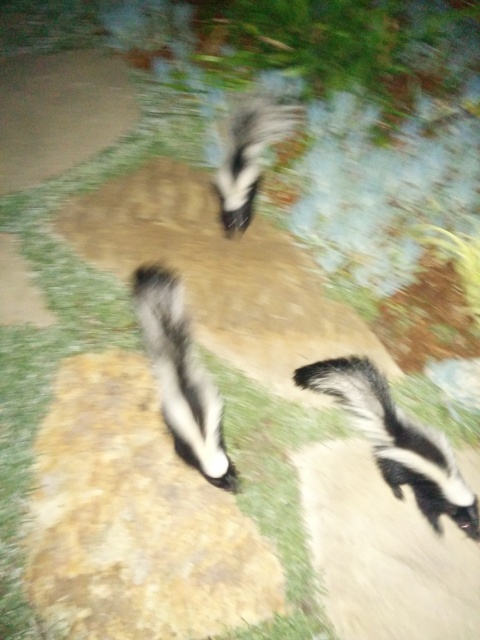
Does black and white fur skunk at center have a larger size compared to black and white fur skunk at upper center?

Actually, black and white fur skunk at center might be smaller than black and white fur skunk at upper center.

Is black and white fur skunk at center shorter than black and white fur skunk at upper center?

Yes.

This screenshot has height=640, width=480. Identify the location of black and white fur skunk at center. (180, 376).

Is black and white fur skunk at lower right wider than black and white fur skunk at center?

Yes.

Can you confirm if black and white fur skunk at lower right is smaller than black and white fur skunk at center?

Actually, black and white fur skunk at lower right might be larger than black and white fur skunk at center.

Find the location of `black and white fur skunk at lower right`. black and white fur skunk at lower right is located at coordinates (396, 440).

Who is shorter, black and white fur skunk at lower right or black and white fur skunk at upper center?

Standing shorter between the two is black and white fur skunk at lower right.

Locate an element on the screen. Image resolution: width=480 pixels, height=640 pixels. black and white fur skunk at lower right is located at coordinates (396, 440).

Where is `black and white fur skunk at lower right`? black and white fur skunk at lower right is located at coordinates (396, 440).